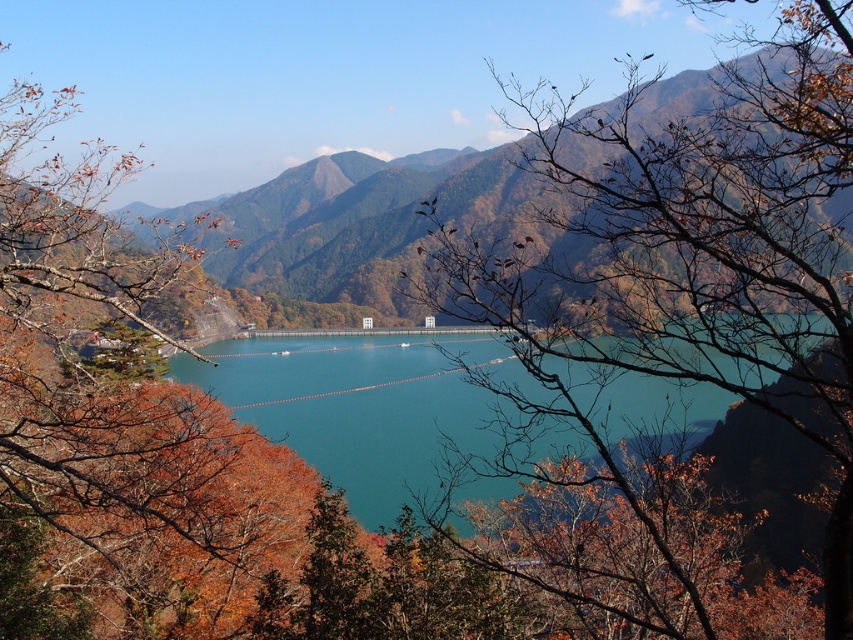
Question: Can you confirm if brown leafy branches at center is positioned to the right of teal glossy water at center?

Choices:
 (A) yes
 (B) no

Answer: (A)

Question: Does brown leafy branches at left appear on the right side of teal glossy water at center?

Choices:
 (A) yes
 (B) no

Answer: (B)

Question: Which object appears closest to the camera in this image?

Choices:
 (A) green grassy mountain at center
 (B) teal glossy water at center
 (C) brown leafy branches at left
 (D) brown leafy branches at center

Answer: (D)

Question: Does brown leafy branches at center appear under green grassy mountain at center?

Choices:
 (A) no
 (B) yes

Answer: (B)

Question: Which object is the closest to the brown leafy branches at left?

Choices:
 (A) brown leafy branches at center
 (B) green grassy mountain at center
 (C) teal glossy water at center

Answer: (C)

Question: Which of the following is the closest to the observer?

Choices:
 (A) green grassy mountain at center
 (B) brown leafy branches at left
 (C) brown leafy branches at center

Answer: (C)